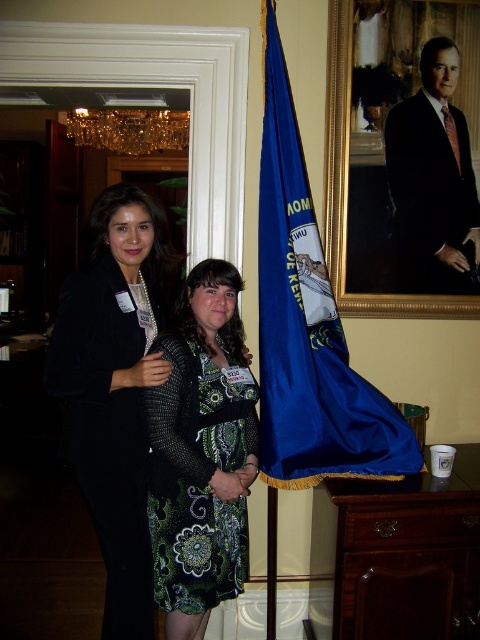
Where is `black textured blazer at center`? The image size is (480, 640). black textured blazer at center is located at coordinates (115, 387).

Does black textured blazer at center have a larger size compared to green paisley dress at center?

Indeed, black textured blazer at center has a larger size compared to green paisley dress at center.

Which is in front, point (83, 484) or point (205, 465)?

Point (205, 465) is more forward.

The image size is (480, 640). In order to click on black textured blazer at center in this screenshot , I will do `click(115, 387)`.

Measure the distance between blue fabric flag at center and camera.

They are 1.97 meters apart.

This screenshot has width=480, height=640. In order to click on blue fabric flag at center in this screenshot , I will do `click(309, 324)`.

Which is behind, point (345, 339) or point (468, 172)?

Point (468, 172)

Locate an element on the screen. This screenshot has width=480, height=640. blue fabric flag at center is located at coordinates (309, 324).

Is black textured blazer at center below formal black suit at upper right?

Indeed, black textured blazer at center is positioned under formal black suit at upper right.

The width and height of the screenshot is (480, 640). Describe the element at coordinates (115, 387) in the screenshot. I see `black textured blazer at center` at that location.

At what (x,y) coordinates should I click in order to perform the action: click on black textured blazer at center. Please return your answer as a coordinate pair (x, y). This screenshot has height=640, width=480. Looking at the image, I should click on (115, 387).